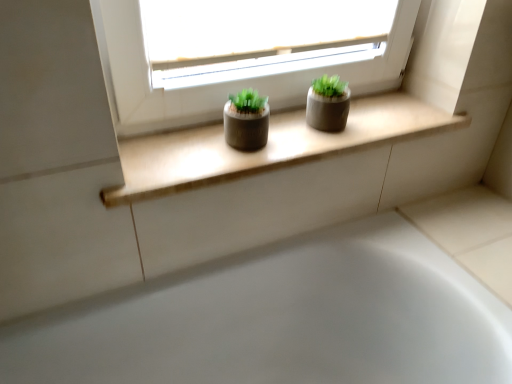
Question: Is matte concrete window sill at center further to the viewer compared to white glossy bathtub at lower center?

Choices:
 (A) no
 (B) yes

Answer: (B)

Question: Is matte concrete window sill at center aimed at white glossy bathtub at lower center?

Choices:
 (A) no
 (B) yes

Answer: (A)

Question: Is matte concrete window sill at center closer to the viewer compared to white glossy bathtub at lower center?

Choices:
 (A) yes
 (B) no

Answer: (B)

Question: Does matte concrete window sill at center have a smaller size compared to white glossy bathtub at lower center?

Choices:
 (A) yes
 (B) no

Answer: (A)

Question: From the image's perspective, is matte concrete window sill at center under white glossy bathtub at lower center?

Choices:
 (A) no
 (B) yes

Answer: (A)

Question: From a real-world perspective, is matte concrete window sill at center beneath white glossy bathtub at lower center?

Choices:
 (A) yes
 (B) no

Answer: (B)

Question: Is white glossy bathtub at lower center positioned beyond the bounds of matte concrete window sill at center?

Choices:
 (A) yes
 (B) no

Answer: (A)

Question: Is white glossy bathtub at lower center directly adjacent to matte concrete window sill at center?

Choices:
 (A) yes
 (B) no

Answer: (B)

Question: Does white glossy bathtub at lower center have a greater width compared to matte concrete window sill at center?

Choices:
 (A) yes
 (B) no

Answer: (A)

Question: Does white glossy bathtub at lower center lie in front of matte concrete window sill at center?

Choices:
 (A) yes
 (B) no

Answer: (A)

Question: Is white glossy bathtub at lower center oriented away from matte concrete window sill at center?

Choices:
 (A) yes
 (B) no

Answer: (B)

Question: Is white glossy bathtub at lower center further to camera compared to matte concrete window sill at center?

Choices:
 (A) no
 (B) yes

Answer: (A)

Question: Is point (271, 137) closer or farther from the camera than point (485, 344)?

Choices:
 (A) closer
 (B) farther

Answer: (B)